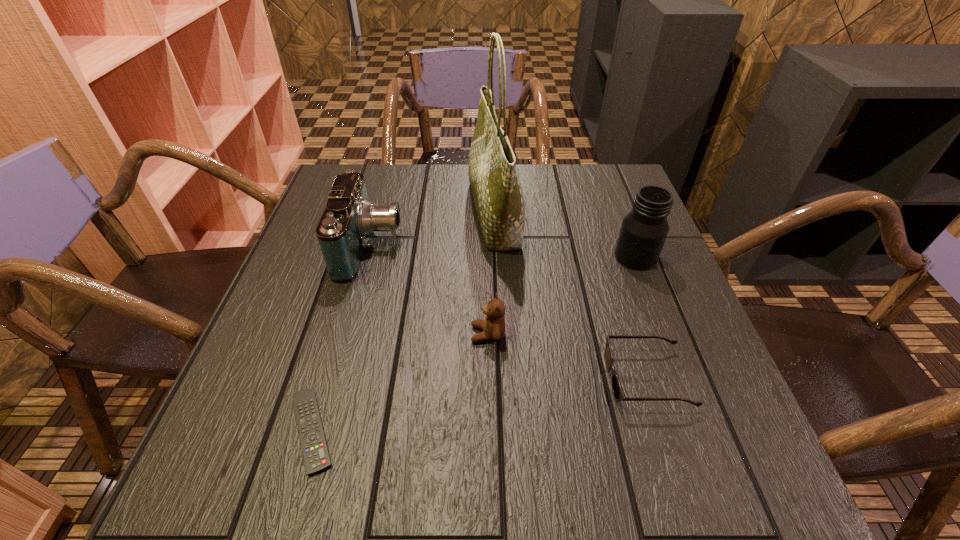
Where is `the tallest object`? This screenshot has width=960, height=540. the tallest object is located at coordinates (497, 192).

What are the coordinates of `jar` in the screenshot? It's located at (644, 229).

You are a GUI agent. You are given a task and a screenshot of the screen. Output one action in this format:
    pyautogui.click(x=<x>, y=<y>)
    Task: Click on the camcorder
    
    Given the screenshot: What is the action you would take?
    pyautogui.click(x=349, y=219)

Where is `the fourth tallest object`? This screenshot has width=960, height=540. the fourth tallest object is located at coordinates (493, 327).

At what (x,y) coordinates should I click in order to perform the action: click on the second shortest object. Please return your answer as a coordinate pair (x, y). Looking at the image, I should click on (617, 390).

The image size is (960, 540). Identify the location of remote control. (316, 456).

The width and height of the screenshot is (960, 540). Identify the location of vacant space located 0.210m on the left of the tallest object. (388, 214).

Identify the location of free space located 0.380m on the front of the jar. (702, 429).

Where is `vacant region located on the front-facing side of the fourth shortest object`? vacant region located on the front-facing side of the fourth shortest object is located at coordinates (447, 247).

What are the coordinates of `vacant region located 0.360m at the face of the teddy bear` in the screenshot? It's located at (288, 334).